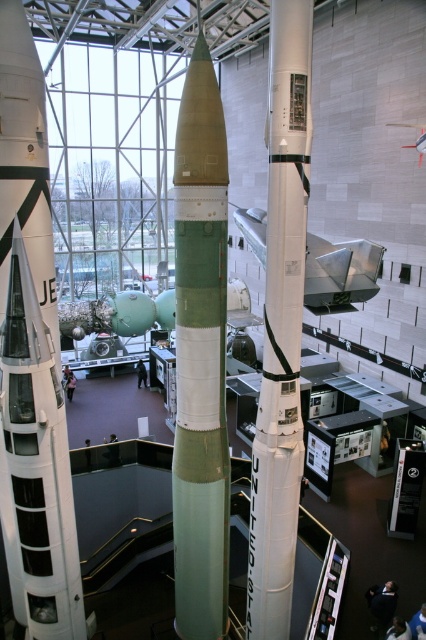
You are a tour guide standing in the aerospace exhibition hall. You want to show visitors the white matte rocket at left. If you are currently 3 meters away from it, can you get closer without moving your feet? Explain why or why not.

The white matte rocket at left and viewer are 4.74 meters apart. Since you are currently 3 meters away, you can move closer by 1.74 meters without needing to move your feet, as the distance between you and the rocket allows for that adjustment.

You are a tour guide leading a group through the museum. You want to point out the white matte rocket at center and the metallic silver airplane at upper right. Which one is closer to the visitors standing at the entrance?

The white matte rocket at center is closer to the visitors because it is positioned in front of the metallic silver airplane at upper right.